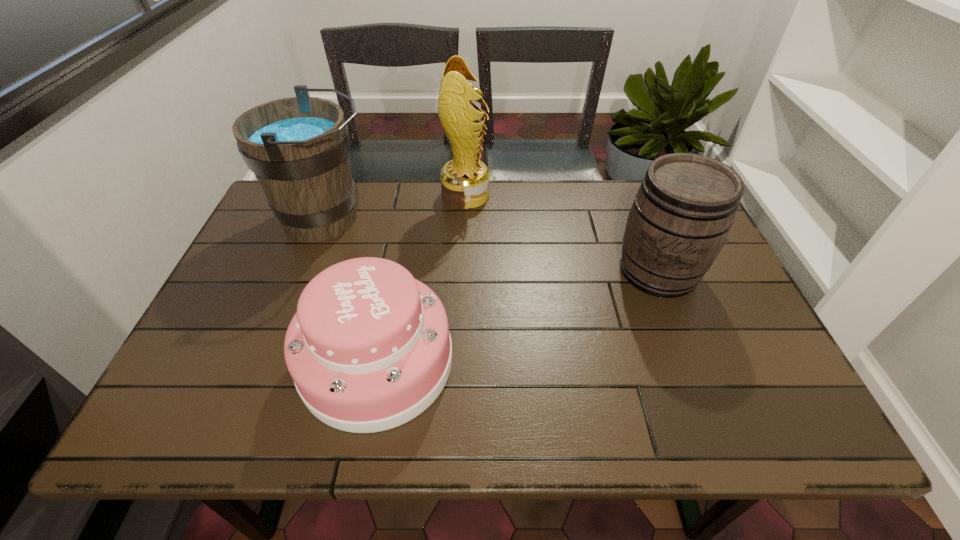
Locate an element on the screen. The width and height of the screenshot is (960, 540). free space that satisfies the following two spatial constraints: 1. on the back side of the nearest object; 2. with a handle on the side of the left wine bucket is located at coordinates (404, 219).

This screenshot has width=960, height=540. I want to click on vacant position in the image that satisfies the following two spatial constraints: 1. with a handle on the side of the left wine bucket; 2. on the left side of the cake, so click(x=272, y=361).

Find the location of a particular element. free space that satisfies the following two spatial constraints: 1. on the front-facing side of the award; 2. on the front side of the cake is located at coordinates (460, 361).

You are a GUI agent. You are given a task and a screenshot of the screen. Output one action in this format:
    pyautogui.click(x=<x>, y=<y>)
    Task: Click on the vacant position in the image that satisfies the following two spatial constraints: 1. on the front-facing side of the tallest object; 2. on the right side of the right wine bucket
    The image size is (960, 540).
    Given the screenshot: What is the action you would take?
    pyautogui.click(x=463, y=271)

The width and height of the screenshot is (960, 540). Find the location of `free point that satisfies the following two spatial constraints: 1. with a handle on the side of the left wine bucket; 2. on the back side of the third tallest object`. free point that satisfies the following two spatial constraints: 1. with a handle on the side of the left wine bucket; 2. on the back side of the third tallest object is located at coordinates (306, 271).

The width and height of the screenshot is (960, 540). I want to click on blank area in the image that satisfies the following two spatial constraints: 1. with a handle on the side of the left wine bucket; 2. on the back side of the second shortest object, so click(306, 271).

In order to click on vacant position in the image that satisfies the following two spatial constraints: 1. on the front-facing side of the tallest object; 2. on the front side of the nearest object in this screenshot , I will do `click(460, 361)`.

Where is `vacant area in the image that satisfies the following two spatial constraints: 1. on the front-facing side of the award; 2. on the left side of the shorter wine bucket`? vacant area in the image that satisfies the following two spatial constraints: 1. on the front-facing side of the award; 2. on the left side of the shorter wine bucket is located at coordinates (463, 271).